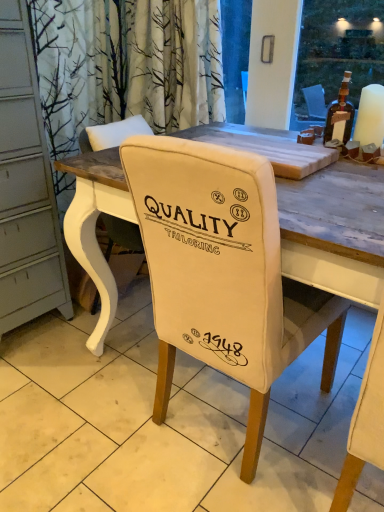
Question: Is white fabric chair back at center outside of white matte candle at upper right?

Choices:
 (A) no
 (B) yes

Answer: (B)

Question: Does white fabric chair back at center lie behind white matte candle at upper right?

Choices:
 (A) yes
 (B) no

Answer: (B)

Question: Considering the relative sizes of white fabric chair back at center and white matte candle at upper right in the image provided, is white fabric chair back at center smaller than white matte candle at upper right?

Choices:
 (A) yes
 (B) no

Answer: (B)

Question: Is white fabric chair back at center in front of white matte candle at upper right?

Choices:
 (A) yes
 (B) no

Answer: (A)

Question: Can you confirm if white fabric chair back at center is positioned to the right of white matte candle at upper right?

Choices:
 (A) no
 (B) yes

Answer: (A)

Question: Is white fabric chair back at center in contact with white matte candle at upper right?

Choices:
 (A) yes
 (B) no

Answer: (B)

Question: Is white fabric chair at center oriented away from white fabric chair back at center?

Choices:
 (A) yes
 (B) no

Answer: (B)

Question: Is white fabric chair at center positioned behind white fabric chair back at center?

Choices:
 (A) no
 (B) yes

Answer: (A)

Question: Is white fabric chair at center outside white fabric chair back at center?

Choices:
 (A) no
 (B) yes

Answer: (B)

Question: Does white fabric chair at center have a lesser height compared to white fabric chair back at center?

Choices:
 (A) yes
 (B) no

Answer: (B)

Question: Considering the relative sizes of white fabric chair at center and white fabric chair back at center in the image provided, is white fabric chair at center taller than white fabric chair back at center?

Choices:
 (A) no
 (B) yes

Answer: (B)

Question: Is white fabric chair at center directly adjacent to white fabric chair back at center?

Choices:
 (A) no
 (B) yes

Answer: (A)

Question: Is the surface of brown glass bottle at upper right in direct contact with white fabric chair back at center?

Choices:
 (A) yes
 (B) no

Answer: (B)